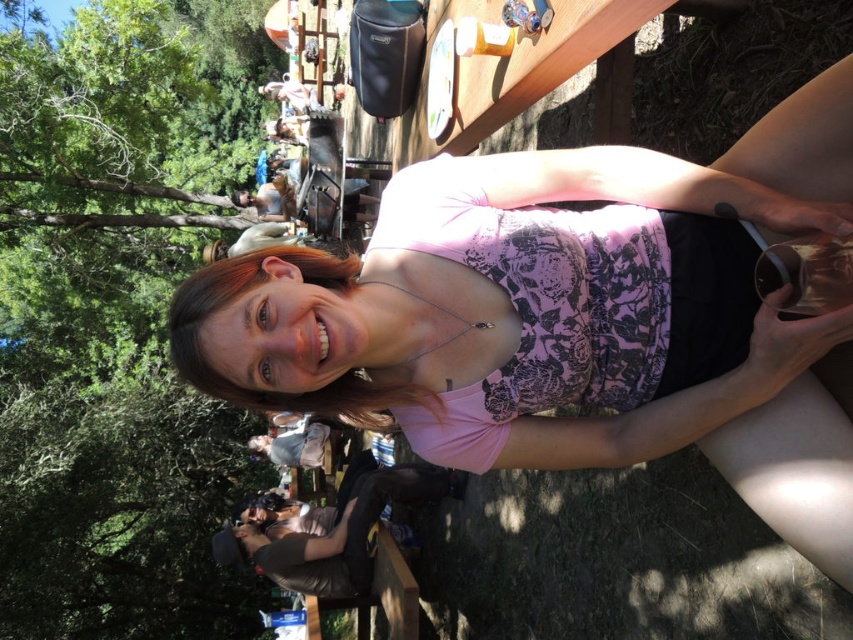
Question: Does black leather jacket at lower center have a lesser width compared to pink fabric blouse at center?

Choices:
 (A) yes
 (B) no

Answer: (B)

Question: Does pink floral tank top at center have a greater width compared to black leather jacket at lower center?

Choices:
 (A) no
 (B) yes

Answer: (A)

Question: Which is nearer to the black leather jacket at lower center?

Choices:
 (A) pink fabric blouse at center
 (B) pink floral tank top at center

Answer: (A)

Question: Is pink floral tank top at center in front of pink fabric blouse at center?

Choices:
 (A) no
 (B) yes

Answer: (B)

Question: Which point appears closest to the camera in this image?

Choices:
 (A) (190, 371)
 (B) (312, 524)

Answer: (A)

Question: Which is farther from the pink floral tank top at center?

Choices:
 (A) pink fabric blouse at center
 (B) black leather jacket at lower center

Answer: (B)